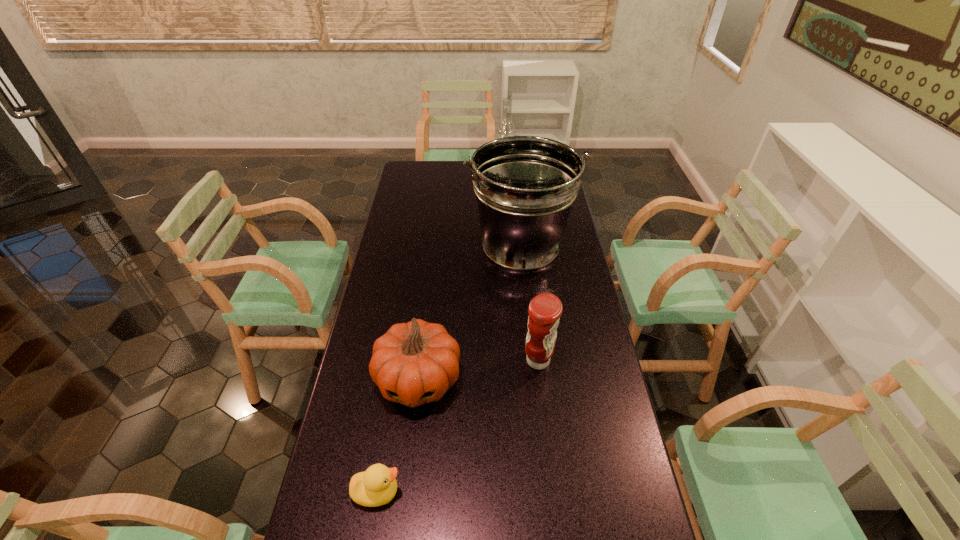
The height and width of the screenshot is (540, 960). I want to click on vacant point located between the second shortest object and the condiment, so (478, 370).

You are a GUI agent. You are given a task and a screenshot of the screen. Output one action in this format:
    pyautogui.click(x=<x>, y=<y>)
    Task: Click on the free spot between the duckling and the third shortest object
    This screenshot has width=960, height=540.
    Given the screenshot: What is the action you would take?
    pyautogui.click(x=458, y=426)

Locate an element on the screen. This screenshot has height=540, width=960. vacant space in between the condiment and the fourth tallest object is located at coordinates (478, 370).

I want to click on free space between the pumpkin and the oil lamp, so click(x=461, y=282).

In order to click on object identified as the third closest to the fourth nearest object in this screenshot , I will do `click(545, 310)`.

Identify which object is located as the third nearest to the second shortest object. Please provide its 2D coordinates. Your answer should be formatted as a tuple, i.e. [(x, y)], where the tuple contains the x and y coordinates of a point satisfying the conditions above.

[(525, 186)]

Locate an element on the screen. The height and width of the screenshot is (540, 960). vacant position in the image that satisfies the following two spatial constraints: 1. on the face of the pumpkin; 2. on the face of the nearest object is located at coordinates (405, 492).

Locate an element on the screen. The image size is (960, 540). vacant region that satisfies the following two spatial constraints: 1. on the face of the second shortest object; 2. on the face of the duckling is located at coordinates (405, 492).

Where is `vacant region that satisfies the following two spatial constraints: 1. on the face of the pumpkin; 2. on the face of the shortest object`? This screenshot has width=960, height=540. vacant region that satisfies the following two spatial constraints: 1. on the face of the pumpkin; 2. on the face of the shortest object is located at coordinates (405, 492).